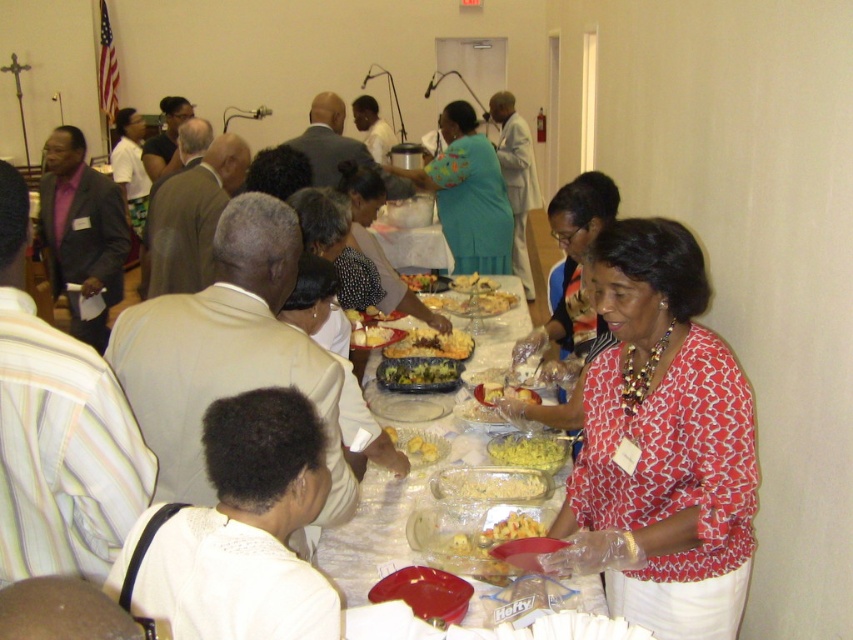
Describe the element at coordinates (577, 260) in the screenshot. I see `printed fabric blouse at center` at that location.

Is point (584, 177) more distant than point (538, 524)?

That is True.

Locate an element on the screen. printed fabric blouse at center is located at coordinates (577, 260).

Describe the element at coordinates (468, 195) in the screenshot. I see `teal fabric dress at center` at that location.

Does point (466, 166) come closer to viewer compared to point (363, 337)?

No, it is behind (363, 337).

Does point (509, 232) come in front of point (372, 339)?

That is False.

This screenshot has height=640, width=853. Identify the location of teal fabric dress at center. (468, 195).

Is polka dot blouse at center thinner than yellow/golden textured pasta at center?

No.

Can you confirm if polka dot blouse at center is positioned below yellow/golden textured pasta at center?

No.

What do you see at coordinates (378, 243) in the screenshot?
I see `polka dot blouse at center` at bounding box center [378, 243].

Locate an element on the screen. This screenshot has height=640, width=853. polka dot blouse at center is located at coordinates click(x=378, y=243).